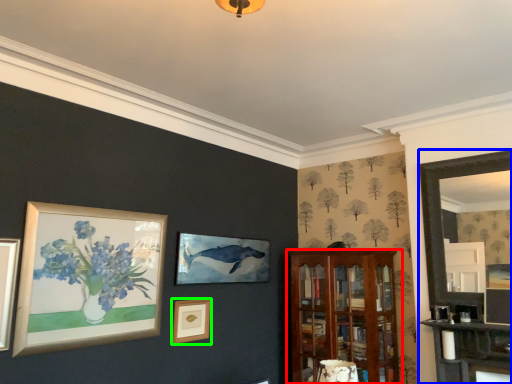
Question: Which object is positioned closest to shelf (highlighted by a red box)? Select from fireplace (highlighted by a blue box) and picture frame (highlighted by a green box).

Choices:
 (A) fireplace
 (B) picture frame

Answer: (A)